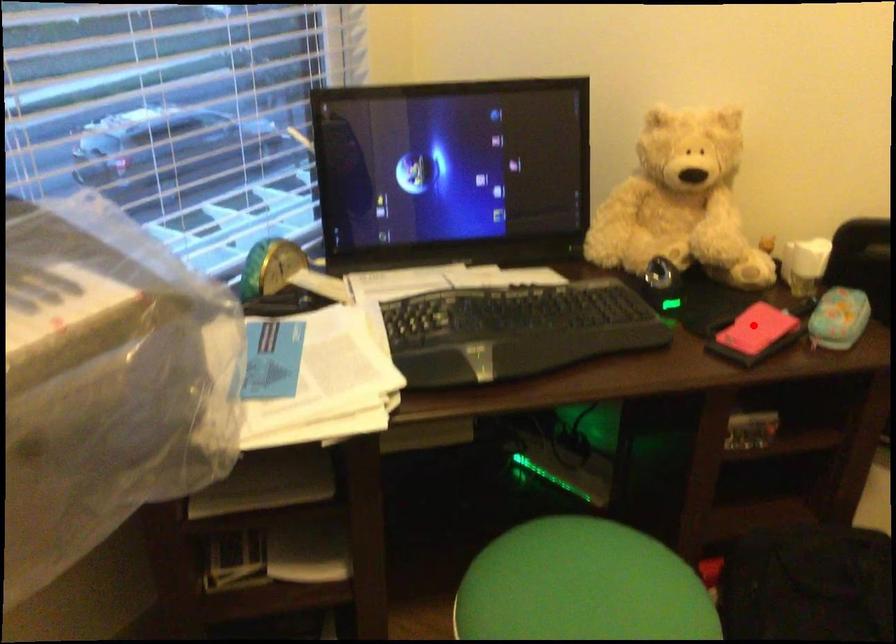
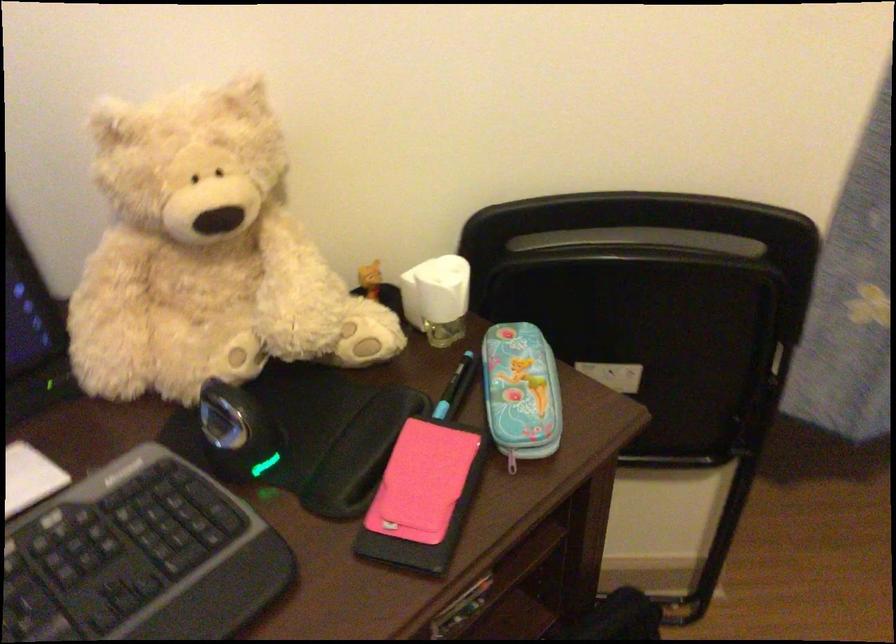
Where in the second image is the point corresponding to the highlighted location from the first image?

(421, 482)